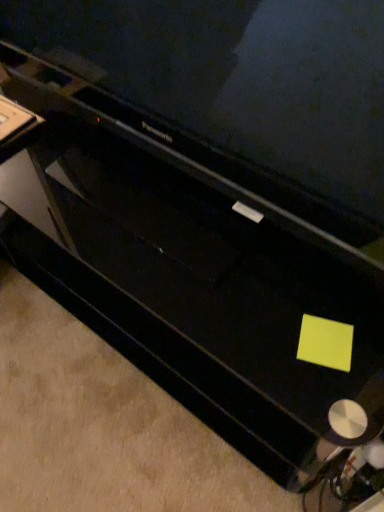
What are the coordinates of `vacant space underneath matte black monitor at center (from a real-world perspective)` in the screenshot? It's located at (173, 226).